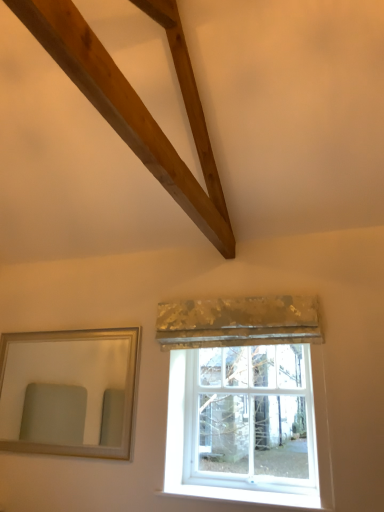
The width and height of the screenshot is (384, 512). Describe the element at coordinates (243, 400) in the screenshot. I see `white glass window at center` at that location.

Where is `white glass window at center`? The height and width of the screenshot is (512, 384). white glass window at center is located at coordinates (243, 400).

What do you see at coordinates (62, 376) in the screenshot? The image size is (384, 512). I see `silver/golden-framed mirror at left` at bounding box center [62, 376].

Locate an element on the screen. gold sequined curtain at center is located at coordinates [238, 322].

From the image's perspective, which is below, silver/golden-framed mirror at left or gold sequined curtain at center?

silver/golden-framed mirror at left is shown below in the image.

Is silver/golden-framed mirror at left to the right of gold sequined curtain at center from the viewer's perspective?

No, silver/golden-framed mirror at left is not to the right of gold sequined curtain at center.

Which of these two, silver/golden-framed mirror at left or gold sequined curtain at center, stands taller?

With more height is silver/golden-framed mirror at left.

From the image's perspective, between white glass window at center and silver/golden-framed mirror at left, who is located below?

white glass window at center is shown below in the image.

Between white glass window at center and silver/golden-framed mirror at left, which one is positioned behind?

silver/golden-framed mirror at left is behind.

This screenshot has width=384, height=512. In order to click on mirror behind the white glass window at center in this screenshot , I will do `click(62, 376)`.

From a real-world perspective, is white glass window at center physically located above or below silver/golden-framed mirror at left?

From a real-world perspective, white glass window at center is physically below silver/golden-framed mirror at left.

Based on the photo, is gold sequined curtain at center situated inside white glass window at center or outside?

gold sequined curtain at center exists outside the volume of white glass window at center.

Considering the sizes of gold sequined curtain at center and white glass window at center in the image, is gold sequined curtain at center taller or shorter than white glass window at center?

In the image, gold sequined curtain at center appears to be shorter than white glass window at center.

Does gold sequined curtain at center have a lesser width compared to white glass window at center?

In fact, gold sequined curtain at center might be wider than white glass window at center.

Can you confirm if white glass window at center is shorter than gold sequined curtain at center?

In fact, white glass window at center may be taller than gold sequined curtain at center.

Can you confirm if white glass window at center is wider than gold sequined curtain at center?

In fact, white glass window at center might be narrower than gold sequined curtain at center.

Which is behind, point (310, 386) or point (168, 303)?

Point (168, 303)

Is silver/golden-framed mirror at left at the left side of white glass window at center?

Yes, silver/golden-framed mirror at left is to the left of white glass window at center.

From the image's perspective, is silver/golden-framed mirror at left positioned above or below white glass window at center?

silver/golden-framed mirror at left is above white glass window at center.

Is silver/golden-framed mirror at left far away from white glass window at center?

Absolutely, silver/golden-framed mirror at left is distant from white glass window at center.

Is gold sequined curtain at center thinner than silver/golden-framed mirror at left?

No, gold sequined curtain at center is not thinner than silver/golden-framed mirror at left.

Is gold sequined curtain at center inside the boundaries of silver/golden-framed mirror at left, or outside?

gold sequined curtain at center is not enclosed by silver/golden-framed mirror at left.

Considering the relative sizes of gold sequined curtain at center and silver/golden-framed mirror at left in the image provided, is gold sequined curtain at center taller than silver/golden-framed mirror at left?

Incorrect, the height of gold sequined curtain at center is not larger of that of silver/golden-framed mirror at left.

From a real-world perspective, is gold sequined curtain at center below silver/golden-framed mirror at left?

Incorrect, from a real-world perspective, gold sequined curtain at center is higher than silver/golden-framed mirror at left.

In order to click on mirror on the left of the gold sequined curtain at center in this screenshot , I will do `click(62, 376)`.

This screenshot has width=384, height=512. What are the coordinates of `mirror behind the white glass window at center` in the screenshot? It's located at (62, 376).

Based on their spatial positions, is white glass window at center or gold sequined curtain at center closer to silver/golden-framed mirror at left?

white glass window at center is closer to silver/golden-framed mirror at left.

Considering their positions, is gold sequined curtain at center positioned further to silver/golden-framed mirror at left than white glass window at center?

gold sequined curtain at center is further to silver/golden-framed mirror at left.

Considering their positions, is gold sequined curtain at center positioned further to white glass window at center than silver/golden-framed mirror at left?

Among the two, silver/golden-framed mirror at left is located further to white glass window at center.

Which object lies further to the anchor point white glass window at center, silver/golden-framed mirror at left or gold sequined curtain at center?

silver/golden-framed mirror at left.

From the image, which object appears to be farther from gold sequined curtain at center, silver/golden-framed mirror at left or white glass window at center?

silver/golden-framed mirror at left lies further to gold sequined curtain at center than the other object.

Which object lies further to the anchor point gold sequined curtain at center, white glass window at center or silver/golden-framed mirror at left?

silver/golden-framed mirror at left lies further to gold sequined curtain at center than the other object.

In order to click on curtain between silver/golden-framed mirror at left and white glass window at center in this screenshot , I will do `click(238, 322)`.